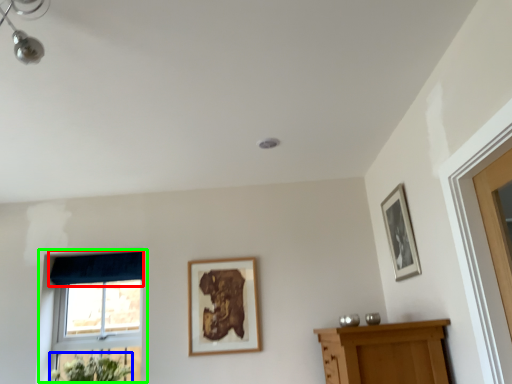
Question: Which object is positioned farthest from curtain (highlighted by a red box)? Select from flower (highlighted by a blue box) and window (highlighted by a green box).

Choices:
 (A) flower
 (B) window

Answer: (A)